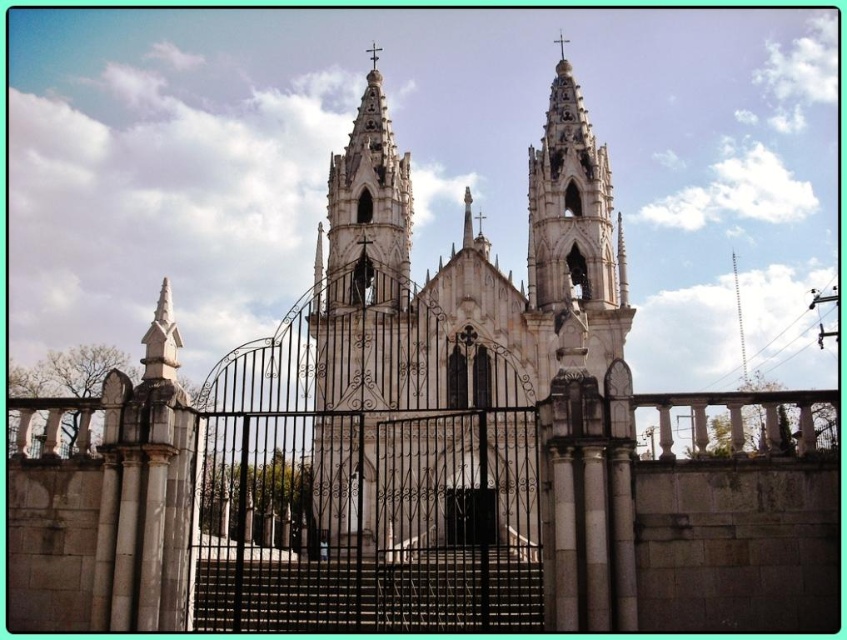
Does point (526, 477) come in front of point (477, 500)?

Yes, it is.

How distant is white stone church at center from black matte door at center?

white stone church at center and black matte door at center are 26.62 meters apart from each other.

Which is in front, point (389, 248) or point (479, 508)?

Point (479, 508) is more forward.

Where is `white stone church at center`? white stone church at center is located at coordinates (466, 276).